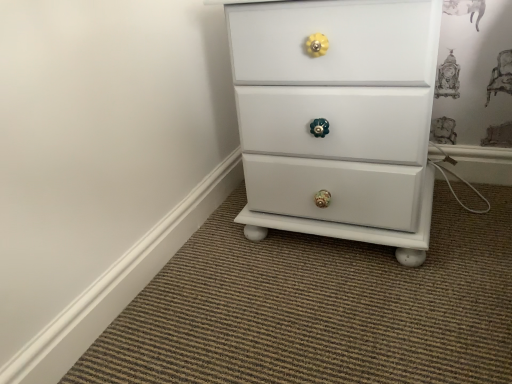
You are a GUI agent. You are given a task and a screenshot of the screen. Output one action in this format:
    pyautogui.click(x=<x>, y=<y>)
    Task: Click on the white glossy chest of drawers at center
    This screenshot has width=512, height=384.
    Given the screenshot: What is the action you would take?
    pyautogui.click(x=337, y=118)

Image resolution: width=512 pixels, height=384 pixels. Describe the element at coordinates (337, 118) in the screenshot. I see `white glossy chest of drawers at center` at that location.

The image size is (512, 384). Identify the location of white glossy chest of drawers at center. (337, 118).